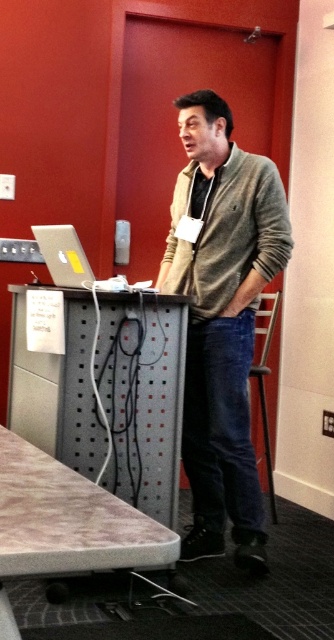
Question: Is metallic gray table at center above silver metallic laptop at left?

Choices:
 (A) no
 (B) yes

Answer: (A)

Question: Which point is farther from the camera taking this photo?

Choices:
 (A) (60, 228)
 (B) (171, 563)
 (C) (148, 412)
 (D) (231, 417)

Answer: (C)

Question: Can you confirm if matte gray sweater at center is wider than silver metallic laptop at left?

Choices:
 (A) no
 (B) yes

Answer: (B)

Question: Which point is closer to the camera taking this photo?

Choices:
 (A) 139,506
 (B) 20,442
 (C) 53,244

Answer: (B)

Question: Can you confirm if matte gray sweater at center is positioned below metallic gray table at center?

Choices:
 (A) no
 (B) yes

Answer: (A)

Question: Which point is farther from the camera taking this photo?

Choices:
 (A) (61, 246)
 (B) (66, 513)
 (C) (181, 344)
 (D) (200, 154)

Answer: (D)